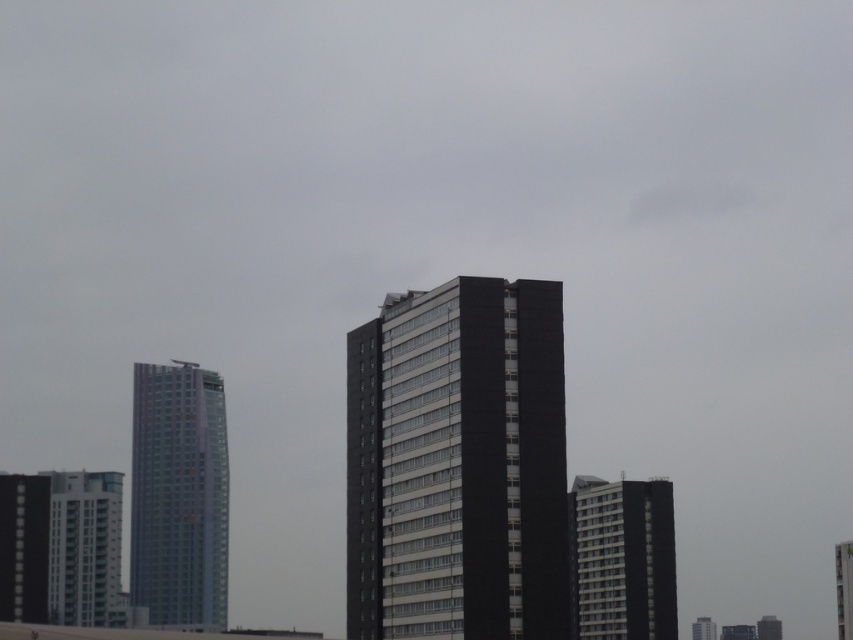
Question: Which object appears closest to the camera in this image?

Choices:
 (A) transparent glass tower at left
 (B) matte black building at left
 (C) white glossy building at right
 (D) black matte building at center

Answer: (D)

Question: Can you confirm if white glass building at left is positioned below matte black building at left?

Choices:
 (A) no
 (B) yes

Answer: (B)

Question: Is white glossy building at lower right further to camera compared to smooth gray building at lower right?

Choices:
 (A) no
 (B) yes

Answer: (A)

Question: Among these points, which one is nearest to the camera?

Choices:
 (A) (27, 508)
 (B) (757, 637)

Answer: (A)

Question: Can you confirm if matte black building at left is thinner than smooth gray building at lower right?

Choices:
 (A) no
 (B) yes

Answer: (B)

Question: Which object is the farthest from the black matte building at center?

Choices:
 (A) white glossy building at lower right
 (B) white glossy building at right
 (C) matte black building at left
 (D) transparent glass tower at left

Answer: (D)